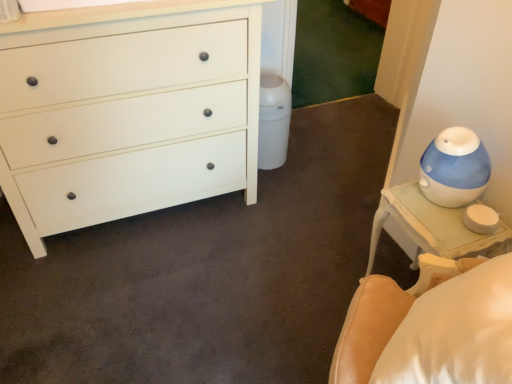
The image size is (512, 384). I want to click on vacant area located to the right-hand side of white matte chest of drawers at left, so [283, 222].